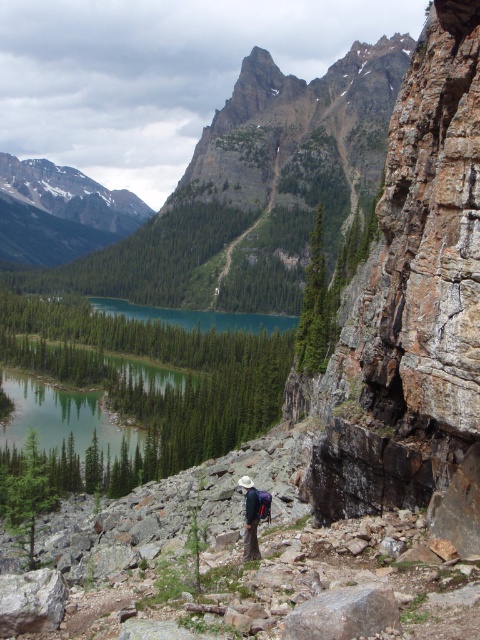
Question: Does rusty brown rock at right have a lesser width compared to teal glossy water at center?

Choices:
 (A) yes
 (B) no

Answer: (A)

Question: Which object is positioned closest to the dark blue fabric backpack at center?

Choices:
 (A) rusty brown rock at right
 (B) gray rough rock at lower center
 (C) teal glossy water at center

Answer: (B)

Question: Observing the image, what is the correct spatial positioning of teal glossy water at center in reference to dark blue fabric backpack at center?

Choices:
 (A) right
 (B) left

Answer: (B)

Question: Which object appears farthest from the camera in this image?

Choices:
 (A) dark blue fabric backpack at center
 (B) rusty brown rock at right
 (C) gray rough rock at lower center

Answer: (A)

Question: Does rusty brown rock at right have a greater width compared to gray rough rock at lower center?

Choices:
 (A) no
 (B) yes

Answer: (B)

Question: Which of these objects is positioned closest to the teal glossy water at center?

Choices:
 (A) gray rough rock at lower center
 (B) rusty brown rock at right

Answer: (B)